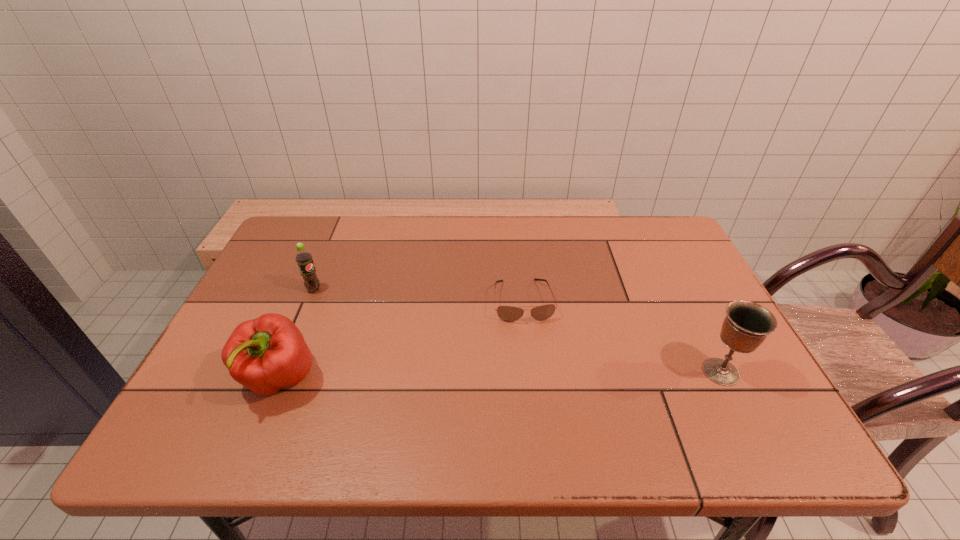
Where is `free space located 0.230m on the front-facing side of the third object from left to right`? The height and width of the screenshot is (540, 960). free space located 0.230m on the front-facing side of the third object from left to right is located at coordinates (541, 403).

Identify the location of vacant space situated 0.130m on the front-facing side of the third object from left to right. This screenshot has width=960, height=540. (535, 366).

Locate an element on the screen. The image size is (960, 540). vacant space located 0.230m on the front-facing side of the third object from left to right is located at coordinates (541, 403).

At what (x,y) coordinates should I click in order to perform the action: click on bell pepper present at the near edge. Please return your answer as a coordinate pair (x, y). The height and width of the screenshot is (540, 960). Looking at the image, I should click on (266, 354).

This screenshot has width=960, height=540. In order to click on chalice that is at the near edge in this screenshot , I will do `click(746, 325)`.

Image resolution: width=960 pixels, height=540 pixels. I want to click on bell pepper at the left edge, so click(266, 354).

Locate an element on the screen. This screenshot has height=540, width=960. soda located at the left edge is located at coordinates (303, 257).

What are the coordinates of `object at the right edge` in the screenshot? It's located at (746, 325).

Where is `object at the near left corner`? Image resolution: width=960 pixels, height=540 pixels. object at the near left corner is located at coordinates (266, 354).

Find the location of a particular element. This screenshot has width=960, height=540. object that is at the near right corner is located at coordinates (746, 325).